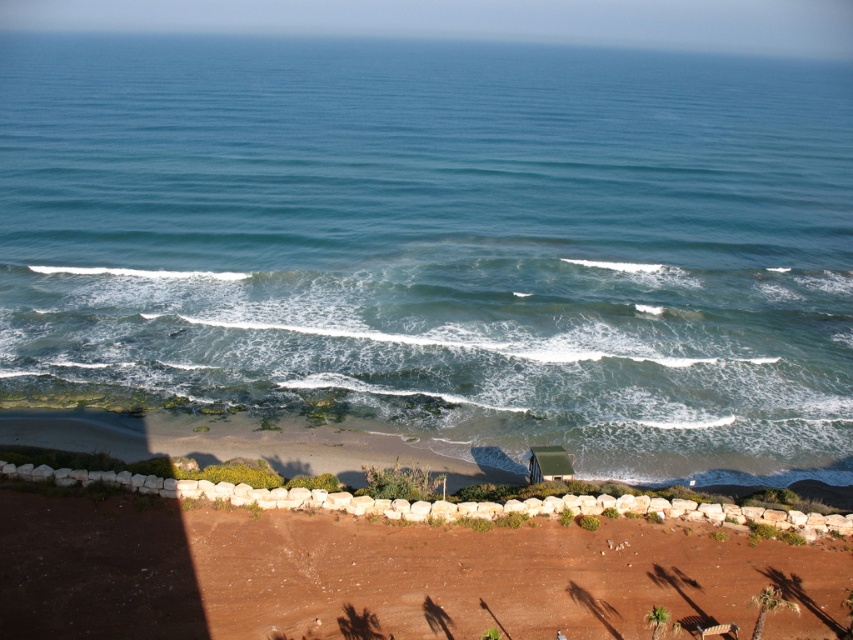
Question: Is blue water at center wider than brown sandy soil at lower center?

Choices:
 (A) yes
 (B) no

Answer: (A)

Question: Which of the following is the closest to the observer?

Choices:
 (A) brown sandy soil at lower center
 (B) blue water at center

Answer: (A)

Question: Which of the following is the closest to the observer?

Choices:
 (A) (344, 381)
 (B) (439, 529)

Answer: (B)

Question: Does blue water at center have a larger size compared to brown sandy soil at lower center?

Choices:
 (A) no
 (B) yes

Answer: (B)

Question: In this image, where is blue water at center located relative to brown sandy soil at lower center?

Choices:
 (A) left
 (B) right

Answer: (B)

Question: Which point appears farthest from the camera in this image?

Choices:
 (A) click(x=355, y=141)
 (B) click(x=701, y=609)

Answer: (A)